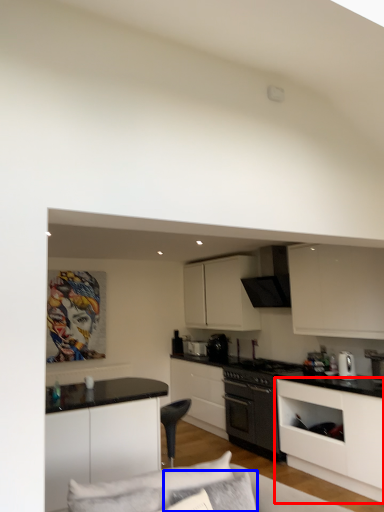
Question: Which object appears closest to the camera in this image, cabinetry (highlighted by a red box) or pillow (highlighted by a blue box)?

Choices:
 (A) cabinetry
 (B) pillow

Answer: (B)